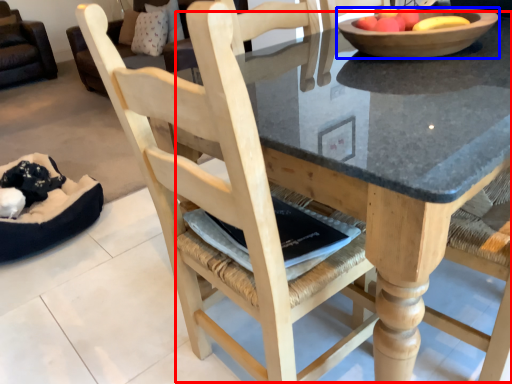
Question: Which of the following is the farthest to the observer, round table (highlighted by a red box) or bowl (highlighted by a blue box)?

Choices:
 (A) round table
 (B) bowl

Answer: (B)